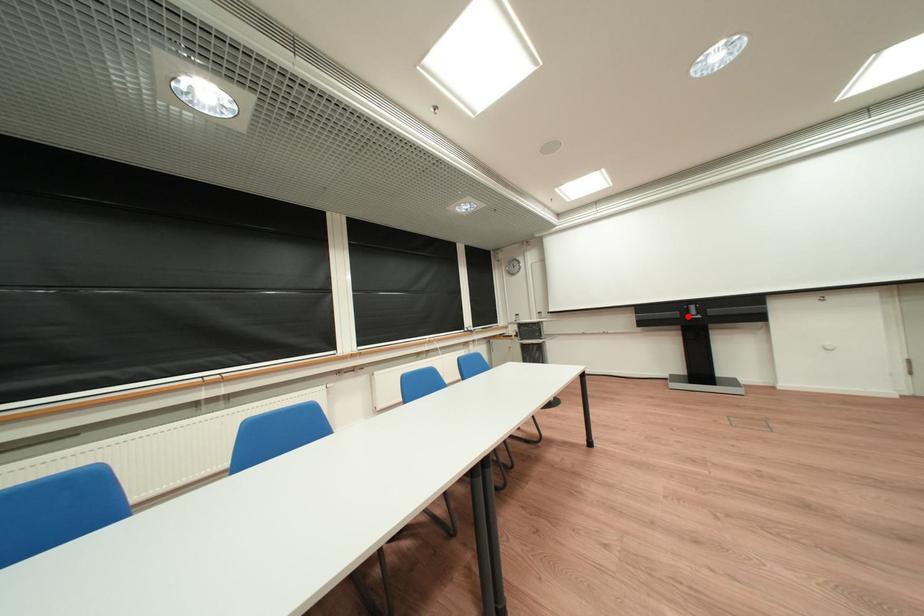
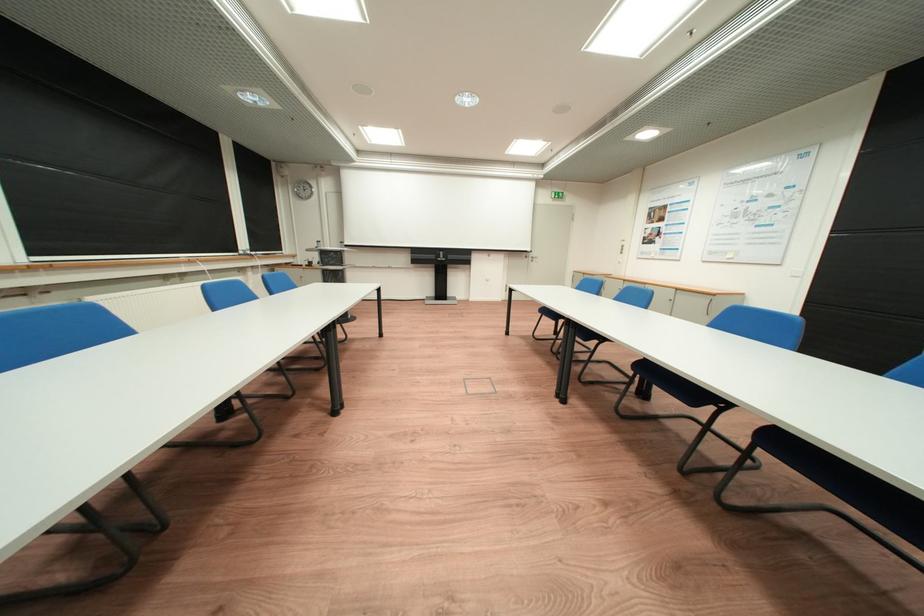
Where in the second image is the point corresponding to the highlighted location from the first image?

(445, 257)